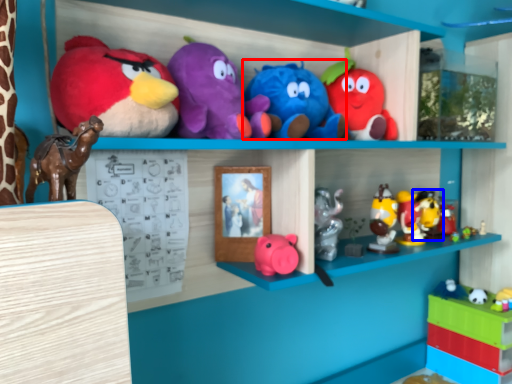
Question: Which point is further to the camera, toy (highlighted by a red box) or toy (highlighted by a blue box)?

Choices:
 (A) toy
 (B) toy

Answer: (B)